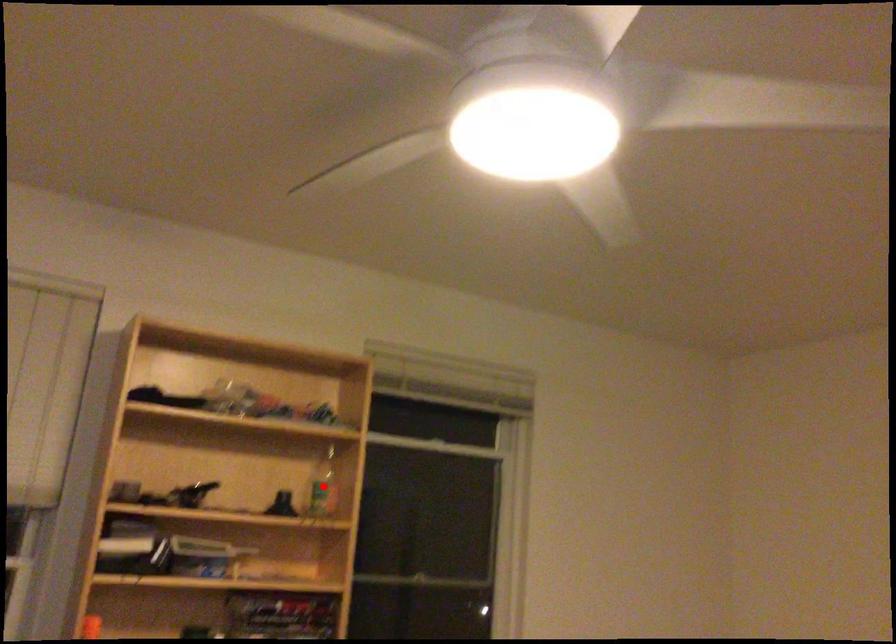
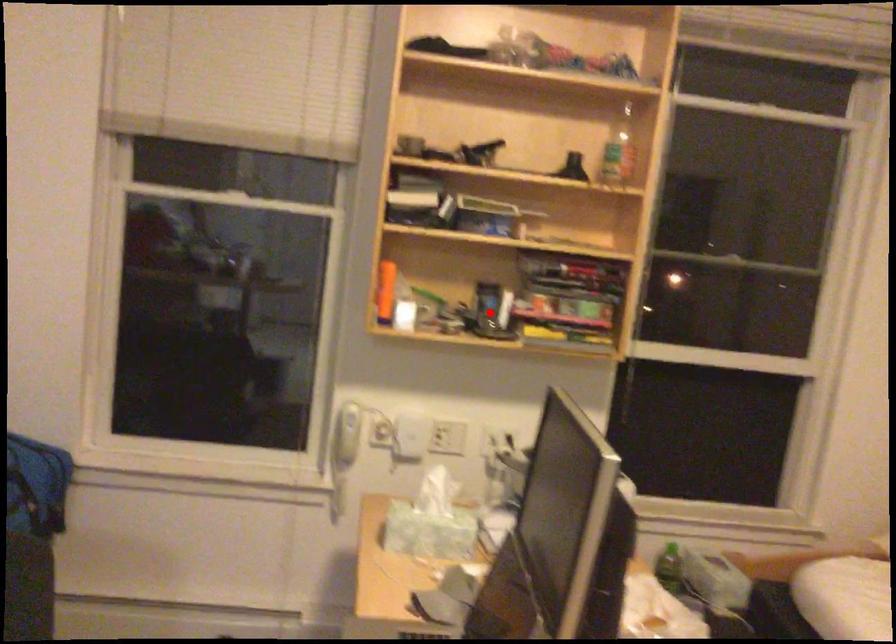
I am providing you with two images of the same scene from different viewpoints. A red point is marked on the first image and another point is marked on the second image. Is the red point in image1 aligned with the point shown in image2?

No